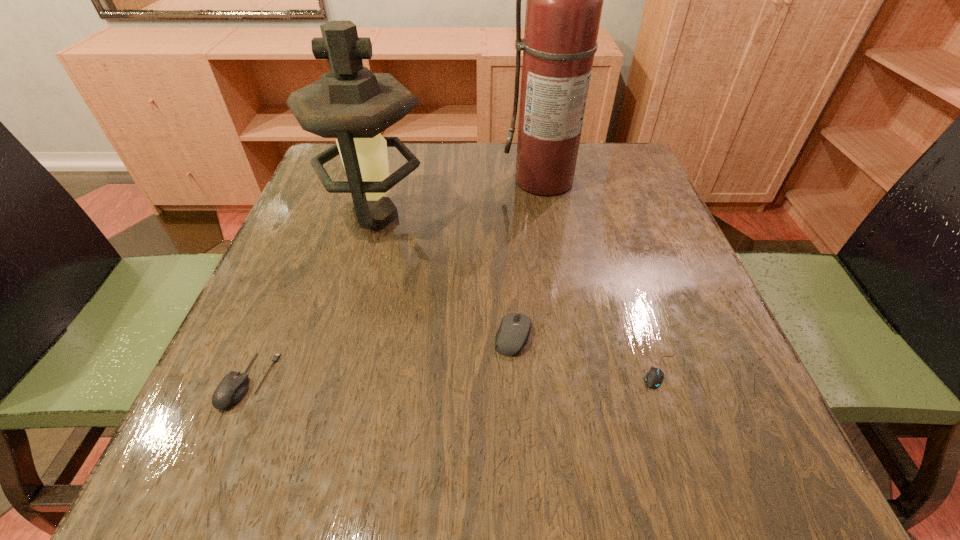
At what (x,y) coordinates should I click in order to perform the action: click on object that is at the far right corner. Please return your answer as a coordinate pair (x, y). Looking at the image, I should click on (564, 0).

The image size is (960, 540). I want to click on free region at the far edge of the desktop, so click(x=427, y=145).

The width and height of the screenshot is (960, 540). In the image, there is a desktop. In order to click on vacant space at the near edge in this screenshot , I will do [x=618, y=463].

In the image, there is a desktop. At what (x,y) coordinates should I click in order to perform the action: click on blank space at the left edge. Please return your answer as a coordinate pair (x, y). The height and width of the screenshot is (540, 960). Looking at the image, I should click on (297, 350).

Locate an element on the screen. The height and width of the screenshot is (540, 960). vacant area at the right edge of the desktop is located at coordinates (636, 293).

Image resolution: width=960 pixels, height=540 pixels. I want to click on vacant space at the far right corner, so click(615, 156).

Locate an element on the screen. vacant region at the near right corner is located at coordinates (757, 483).

Locate an element on the screen. The width and height of the screenshot is (960, 540). vacant space that is in between the oil lamp and the tallest object is located at coordinates (461, 199).

In order to click on free space between the second tallest object and the tallest object in this screenshot , I will do `click(461, 199)`.

Identify the location of free space between the fire extinguisher and the tallest mouse. This screenshot has height=540, width=960. (529, 258).